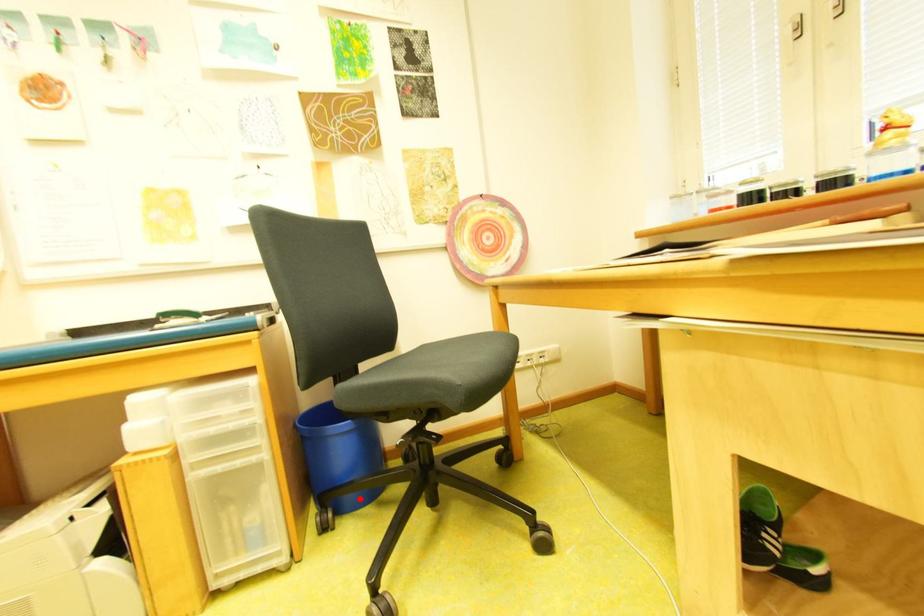
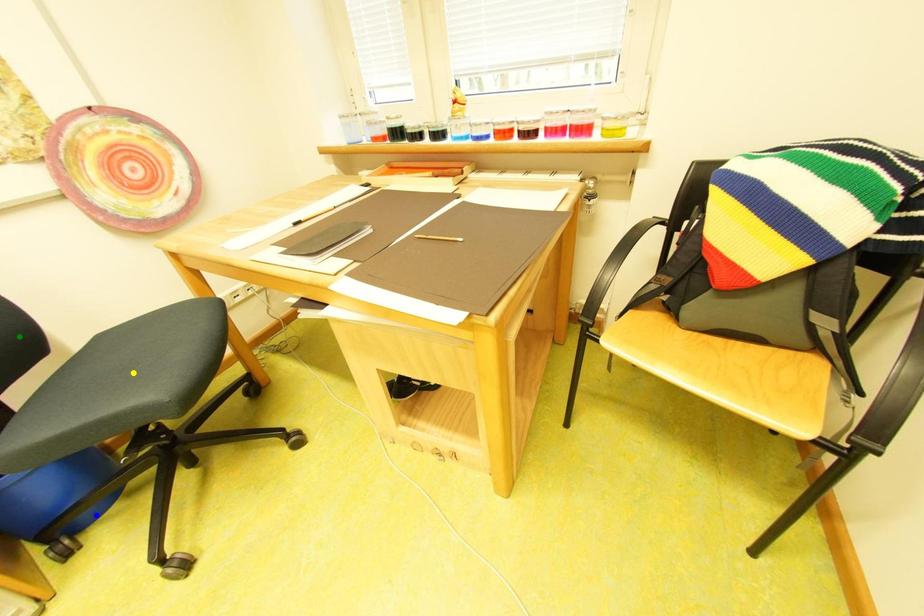
Question: I am providing you with two images of the same scene from different viewpoints. A red point is marked on the first image. You are given multiple points on the second image. Which point in image 2 is actually the same real-world point as the red point in image 1?

Choices:
 (A) yellow point
 (B) blue point
 (C) green point

Answer: (B)